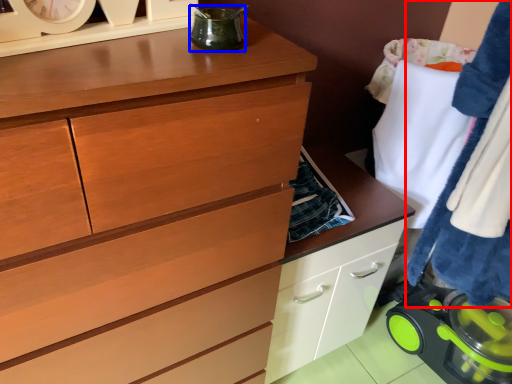
Question: Which point is further to the camera, clothing (highlighted by a red box) or appliance (highlighted by a blue box)?

Choices:
 (A) clothing
 (B) appliance

Answer: (A)